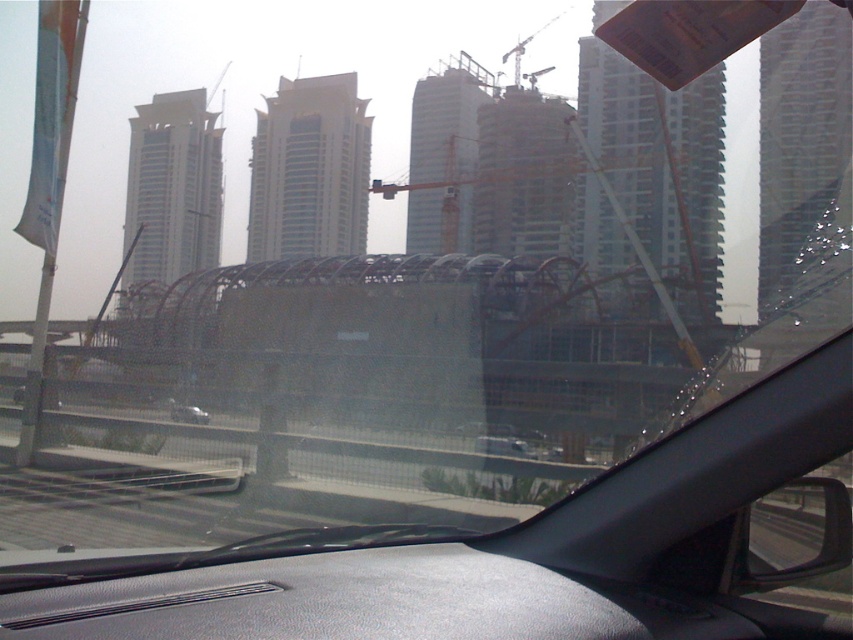
You are driving a car and want to know if there is enough space between the gray textured dashboard at center and the silver metallic car at center to safely stop your vehicle. Your car requires 8 meters to stop. Can you stop safely?

The distance between the gray textured dashboard at center and the silver metallic car at center is 7.57 meters, which is less than the required 8 meters to stop safely. Therefore, you cannot stop safely in this distance.

You are sitting in the driver seat of a car and want to reach the gray textured dashboard at center to adjust the climate control. Considering your average arm length is 2.5 feet, can you comfortably reach it without stretching?

The gray textured dashboard at center is 7.62 feet away from viewer. Since your arm length is only 2.5 feet, you cannot comfortably reach it without stretching.

You are driving a car and want to check if your car fits through a narrow tunnel entrance. The tunnel entrance is as wide as the gray textured dashboard at center. Can your white matte car at center pass through it?

The gray textured dashboard at center is wider than the white matte car at center. Since the tunnel entrance is as wide as the dashboard, the white matte car at center can pass through the tunnel entrance without any issues.